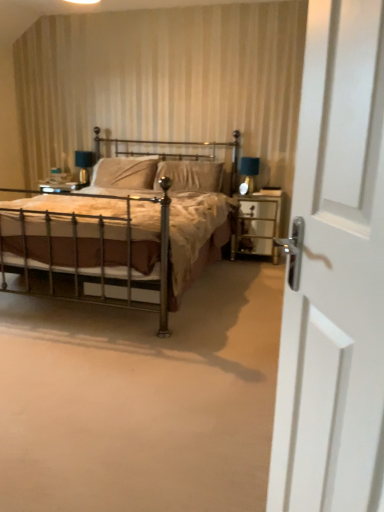
Image resolution: width=384 pixels, height=512 pixels. What do you see at coordinates (248, 174) in the screenshot?
I see `matte black table lamp at right, which is counted as the 1th table lamp, starting from the front` at bounding box center [248, 174].

What do you see at coordinates (258, 224) in the screenshot? I see `clear glass nightstand at right` at bounding box center [258, 224].

What is the approximate height of white glossy door at right?

4.42 feet.

Describe the element at coordinates (125, 172) in the screenshot. Image resolution: width=384 pixels, height=512 pixels. I see `suede-like beige pillow at center, which is the first pillow from left to right` at that location.

What do you see at coordinates (116, 239) in the screenshot? I see `polished brass bed at center` at bounding box center [116, 239].

What do you see at coordinates (191, 175) in the screenshot?
I see `suede-like beige pillow at center, the 1th pillow in the right-to-left sequence` at bounding box center [191, 175].

The height and width of the screenshot is (512, 384). I want to click on matte black table lamp at right, the 1th table lamp when ordered from right to left, so click(248, 174).

Which object is wider, matte blue glass table lamp at upper left, positioned as the second table lamp in front-to-back order, or polished brass bed at center?

polished brass bed at center is wider.

What's the angular difference between matte blue glass table lamp at upper left, marked as the 2th table lamp in a right-to-left arrangement, and polished brass bed at center's facing directions?

There is a 0.000337-degree angle between the facing directions of matte blue glass table lamp at upper left, marked as the 2th table lamp in a right-to-left arrangement, and polished brass bed at center.

Is matte blue glass table lamp at upper left, marked as the 2th table lamp in a right-to-left arrangement, oriented away from polished brass bed at center?

Absolutely, matte blue glass table lamp at upper left, marked as the 2th table lamp in a right-to-left arrangement, is directed away from polished brass bed at center.

Is point (91, 160) closer or farther from the camera than point (224, 159)?

Point (91, 160) is farther from the camera than point (224, 159).

Considering the sizes of objects clear glass nightstand at right and white glossy door at right in the image provided, who is shorter, clear glass nightstand at right or white glossy door at right?

clear glass nightstand at right.

Is clear glass nightstand at right outside of white glossy door at right?

Yes.

Between clear glass nightstand at right and white glossy door at right, which one appears on the right side from the viewer's perspective?

clear glass nightstand at right is more to the right.

Is suede-like beige pillow at center, the 2th pillow positioned from the right, beside matte black table lamp at right, the 1th table lamp when ordered from right to left?

No.

From a real-world perspective, who is located higher, suede-like beige pillow at center, which is the first pillow from left to right, or matte black table lamp at right, arranged as the second table lamp when viewed from the left?

In real-world perspective, suede-like beige pillow at center, which is the first pillow from left to right, is above.

Is point (150, 167) in front of point (246, 192)?

No, it is not.

From the image's perspective, between suede-like beige pillow at center, the 2th pillow positioned from the right, and matte black table lamp at right, the 1th table lamp when ordered from right to left, who is located below?

matte black table lamp at right, the 1th table lamp when ordered from right to left, appears lower in the image.

Based on the photo, who is bigger, white glossy door at right or matte black table lamp at right, arranged as the second table lamp when viewed from the left?

With larger size is white glossy door at right.

Considering the positions of points (374, 95) and (250, 190), is point (374, 95) farther from camera compared to point (250, 190)?

No, (374, 95) is closer to viewer.

From a real-world perspective, is white glossy door at right located higher than matte black table lamp at right, arranged as the second table lamp when viewed from the left?

No, from a real-world perspective, white glossy door at right is not on top of matte black table lamp at right, arranged as the second table lamp when viewed from the left.

Is white glossy door at right far from matte black table lamp at right, the 1th table lamp when ordered from right to left?

Indeed, white glossy door at right is not near matte black table lamp at right, the 1th table lamp when ordered from right to left.

Which is less distant, (379, 170) or (93, 160)?

Clearly, point (379, 170) is closer to the camera than point (93, 160).

Can you confirm if white glossy door at right is wider than matte blue glass table lamp at upper left, positioned as the second table lamp in front-to-back order?

In fact, white glossy door at right might be narrower than matte blue glass table lamp at upper left, positioned as the second table lamp in front-to-back order.

Is white glossy door at right next to matte blue glass table lamp at upper left, positioned as the second table lamp in front-to-back order, and touching it?

white glossy door at right is not next to matte blue glass table lamp at upper left, positioned as the second table lamp in front-to-back order, and they're not touching.

How far apart are white glossy door at right and matte blue glass table lamp at upper left, marked as the 1th table lamp in a left-to-right arrangement?

3.94 meters.

Between suede-like beige pillow at center, the 2th pillow positioned from the right, and matte blue glass table lamp at upper left, positioned as the second table lamp in front-to-back order, which one appears on the right side from the viewer's perspective?

Positioned to the right is suede-like beige pillow at center, the 2th pillow positioned from the right.

From the picture: Can you confirm if suede-like beige pillow at center, the 2th pillow positioned from the right, is wider than matte blue glass table lamp at upper left, marked as the 1th table lamp in a back-to-front arrangement?

Indeed, suede-like beige pillow at center, the 2th pillow positioned from the right, has a greater width compared to matte blue glass table lamp at upper left, marked as the 1th table lamp in a back-to-front arrangement.

Is suede-like beige pillow at center, the 2th pillow positioned from the right, far from matte blue glass table lamp at upper left, marked as the 1th table lamp in a left-to-right arrangement?

No, suede-like beige pillow at center, the 2th pillow positioned from the right, is not far from matte blue glass table lamp at upper left, marked as the 1th table lamp in a left-to-right arrangement.

From a real-world perspective, is suede-like beige pillow at center, which is the first pillow from left to right, physically below matte blue glass table lamp at upper left, marked as the 1th table lamp in a back-to-front arrangement?

No, from a real-world perspective, suede-like beige pillow at center, which is the first pillow from left to right, is not under matte blue glass table lamp at upper left, marked as the 1th table lamp in a back-to-front arrangement.

Is matte black table lamp at right, the 1th table lamp when ordered from right to left, turned away from suede-like beige pillow at center, which is the first pillow from left to right?

That's not correct — matte black table lamp at right, the 1th table lamp when ordered from right to left, is not looking away from suede-like beige pillow at center, which is the first pillow from left to right.

From the image's perspective, is matte black table lamp at right, which is counted as the 1th table lamp, starting from the front, above or below suede-like beige pillow at center, the 2th pillow positioned from the right?

matte black table lamp at right, which is counted as the 1th table lamp, starting from the front, is situated lower than suede-like beige pillow at center, the 2th pillow positioned from the right, in the image.

Between matte black table lamp at right, the 1th table lamp when ordered from right to left, and suede-like beige pillow at center, which is the first pillow from left to right, which one has smaller width?

matte black table lamp at right, the 1th table lamp when ordered from right to left, is thinner.

Does matte black table lamp at right, which is counted as the 1th table lamp, starting from the front, contain suede-like beige pillow at center, the 2th pillow positioned from the right?

No.

Where is `bed that appears below the matte blue glass table lamp at upper left, positioned as the second table lamp in front-to-back order (from the image's perspective)`? This screenshot has height=512, width=384. bed that appears below the matte blue glass table lamp at upper left, positioned as the second table lamp in front-to-back order (from the image's perspective) is located at coordinates (116, 239).

Where is `nightstand on the right of white glossy door at right`? This screenshot has height=512, width=384. nightstand on the right of white glossy door at right is located at coordinates (258, 224).

From the picture: Estimate the real-world distances between objects in this image. Which object is closer to clear glass nightstand at right, white glossy door at right or matte black table lamp at right, placed as the 2th table lamp when sorted from back to front?

matte black table lamp at right, placed as the 2th table lamp when sorted from back to front, is closer to clear glass nightstand at right.

In the scene shown: Considering their positions, is white glossy door at right positioned closer to suede-like beige pillow at center, which is the first pillow from left to right, than suede-like beige pillow at center, the 1th pillow in the right-to-left sequence?

Based on the image, suede-like beige pillow at center, the 1th pillow in the right-to-left sequence, appears to be nearer to suede-like beige pillow at center, which is the first pillow from left to right.

When comparing their distances from matte blue glass table lamp at upper left, marked as the 2th table lamp in a right-to-left arrangement, does suede-like beige pillow at center, the 2th pillow positioned from the left, or polished brass bed at center seem closer?

The object closer to matte blue glass table lamp at upper left, marked as the 2th table lamp in a right-to-left arrangement, is suede-like beige pillow at center, the 2th pillow positioned from the left.

Based on their spatial positions, is matte black table lamp at right, placed as the 2th table lamp when sorted from back to front, or white glossy door at right further from suede-like beige pillow at center, the 2th pillow positioned from the right?

Based on the image, white glossy door at right appears to be further to suede-like beige pillow at center, the 2th pillow positioned from the right.

Considering their positions, is clear glass nightstand at right positioned closer to matte black table lamp at right, arranged as the second table lamp when viewed from the left, than suede-like beige pillow at center, the 2th pillow positioned from the left?

Based on the image, clear glass nightstand at right appears to be nearer to matte black table lamp at right, arranged as the second table lamp when viewed from the left.

Looking at the image, which one is located further to polished brass bed at center, suede-like beige pillow at center, the 2th pillow positioned from the right, or matte black table lamp at right, the 1th table lamp when ordered from right to left?

Based on the image, matte black table lamp at right, the 1th table lamp when ordered from right to left, appears to be further to polished brass bed at center.

Which object lies further to the anchor point matte black table lamp at right, the 1th table lamp when ordered from right to left, clear glass nightstand at right or matte blue glass table lamp at upper left, marked as the 1th table lamp in a left-to-right arrangement?

matte blue glass table lamp at upper left, marked as the 1th table lamp in a left-to-right arrangement, lies further to matte black table lamp at right, the 1th table lamp when ordered from right to left, than the other object.

From the image, which object appears to be farther from matte blue glass table lamp at upper left, marked as the 1th table lamp in a left-to-right arrangement, clear glass nightstand at right or matte black table lamp at right, arranged as the second table lamp when viewed from the left?

clear glass nightstand at right.

This screenshot has height=512, width=384. I want to click on bed positioned between white glossy door at right and matte blue glass table lamp at upper left, marked as the 2th table lamp in a right-to-left arrangement, from near to far, so click(x=116, y=239).

Find the location of a particular element. Image resolution: width=384 pixels, height=512 pixels. nightstand positioned between white glossy door at right and suede-like beige pillow at center, which is the first pillow from left to right, from near to far is located at coordinates tap(258, 224).

Locate an element on the screen. The height and width of the screenshot is (512, 384). table lamp positioned between white glossy door at right and matte blue glass table lamp at upper left, marked as the 1th table lamp in a left-to-right arrangement, from near to far is located at coordinates pos(248,174).

You are a GUI agent. You are given a task and a screenshot of the screen. Output one action in this format:
    pyautogui.click(x=<x>, y=<y>)
    Task: Click on the nightstand between polished brass bed at center and suede-like beige pillow at center, the 2th pillow positioned from the left, in the front-back direction
    The width and height of the screenshot is (384, 512).
    Given the screenshot: What is the action you would take?
    pyautogui.click(x=258, y=224)